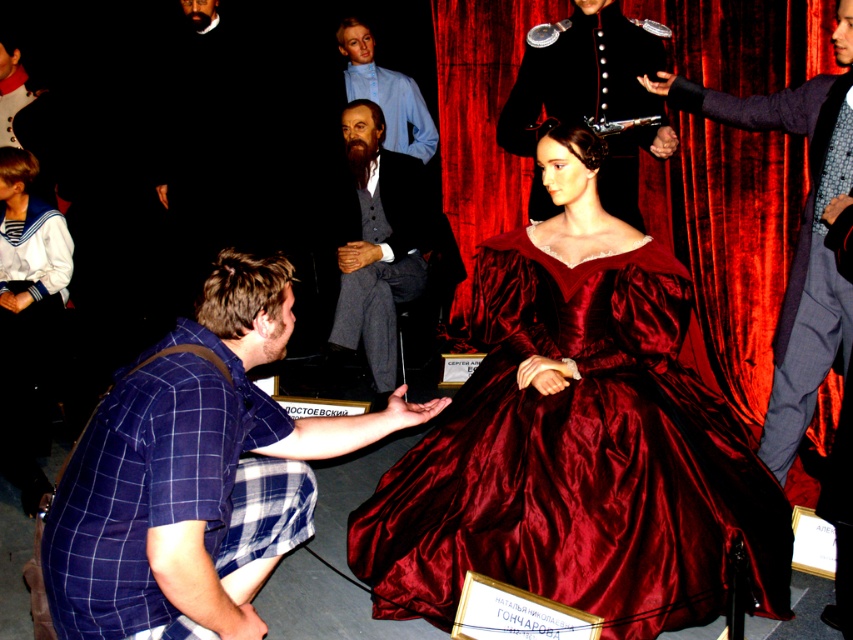
You are a visitor at the wax museum and notice two figures in the scene. One is the mannequin in the deep red Victorian gown, and the other is a person in a shiny black uniform at upper center. Based on their positions, which figure is closer to you?

The shiny black uniform at upper center is closer to you because it is positioned at point (590, 97), which is in the upper center and likely closer to the viewer compared to the mannequin in the deep red gown positioned against the backdrop.

You are standing in the wax museum and want to take a closer look at the shiny burgundy gown at center. If you can only move forward 6 feet, will you be able to get within 8 feet of the gown?

The shiny burgundy gown at center is currently 7.78 feet away from you. If you move forward 6 feet, your new distance will be 7.78 minus 6 equals 1.78 feet. Since 1.78 feet is less than 8 feet, yes, you will be within 8 feet of the gown.

You are standing in front of the mannequin in the red gown. There are two points marked in the scene. One is at coordinate point (476, 496) and the other is at point (270, 349). Which point is closer to you?

Point (270, 349) is closer to you because it is less further to the camera than point (476, 496).